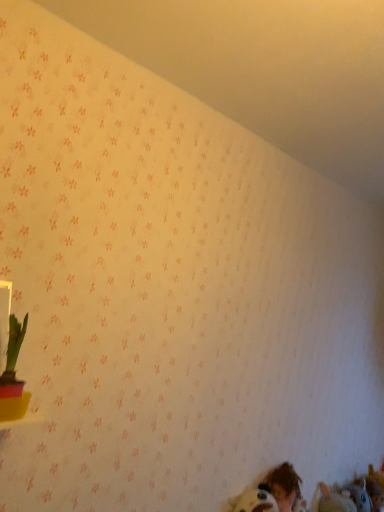
Question: Is there a large distance between green leafy plant in pink pot at left and fuzzy brown stuffed toy at lower right, marked as the 2th animal in a back-to-front arrangement?

Choices:
 (A) no
 (B) yes

Answer: (B)

Question: Is fuzzy brown stuffed toy at lower right, the second animal positioned from the right, a part of green leafy plant in pink pot at left?

Choices:
 (A) yes
 (B) no

Answer: (B)

Question: Is green leafy plant in pink pot at left to the left of fuzzy brown stuffed toy at lower right, the second animal positioned from the right, from the viewer's perspective?

Choices:
 (A) no
 (B) yes

Answer: (B)

Question: Is the surface of green leafy plant in pink pot at left in direct contact with fuzzy brown stuffed toy at lower right, which is the 1th animal in front-to-back order?

Choices:
 (A) yes
 (B) no

Answer: (B)

Question: Is green leafy plant in pink pot at left further to camera compared to fuzzy brown stuffed toy at lower right, the second animal positioned from the right?

Choices:
 (A) yes
 (B) no

Answer: (B)

Question: Which is correct: brown plush toy at lower right, which is the second animal in front-to-back order, is inside brown hair at lower right, or outside of it?

Choices:
 (A) inside
 (B) outside

Answer: (B)

Question: Is brown plush toy at lower right, which appears as the first animal when viewed from the right, wider or thinner than brown hair at lower right?

Choices:
 (A) wide
 (B) thin

Answer: (A)

Question: Does point (374, 507) appear closer or farther from the camera than point (291, 470)?

Choices:
 (A) farther
 (B) closer

Answer: (A)

Question: Is brown plush toy at lower right, which appears as the first animal when viewed from the right, in front of or behind brown hair at lower right in the image?

Choices:
 (A) front
 (B) behind

Answer: (B)

Question: From a real-world perspective, relative to fuzzy brown stuffed toy at lower right, the second animal positioned from the right, is brown plush toy at lower right, which appears as the first animal when viewed from the right, vertically above or below?

Choices:
 (A) below
 (B) above

Answer: (B)

Question: Is brown plush toy at lower right, arranged as the 2th animal when viewed from the left, situated inside fuzzy brown stuffed toy at lower right, the second animal positioned from the right, or outside?

Choices:
 (A) outside
 (B) inside

Answer: (A)

Question: Looking at the image, does brown plush toy at lower right, which is the second animal in front-to-back order, seem bigger or smaller compared to fuzzy brown stuffed toy at lower right, the 1th animal when ordered from left to right?

Choices:
 (A) small
 (B) big

Answer: (B)

Question: From their relative heights in the image, would you say brown plush toy at lower right, arranged as the 2th animal when viewed from the left, is taller or shorter than fuzzy brown stuffed toy at lower right, the second animal positioned from the right?

Choices:
 (A) short
 (B) tall

Answer: (B)

Question: Would you say brown hair at lower right is to the left or to the right of fuzzy brown stuffed toy at lower right, the 1th animal when ordered from left to right, in the picture?

Choices:
 (A) right
 (B) left

Answer: (B)

Question: Relative to fuzzy brown stuffed toy at lower right, which is the 1th animal in front-to-back order, is brown hair at lower right in front or behind?

Choices:
 (A) behind
 (B) front

Answer: (B)